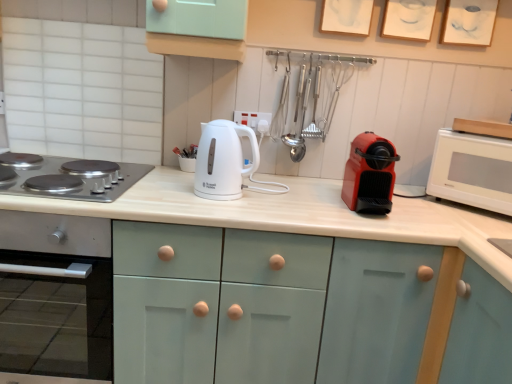
Measure the distance between point (220,158) and camera.

A distance of 4.13 feet exists between point (220,158) and camera.

Find the location of a particular element. The width and height of the screenshot is (512, 384). white glossy electric kettle at center, acting as the 1th kitchen appliance starting from the left is located at coordinates (223, 160).

What is the approximate width of white matte countertop at center?

4.68 feet.

What is the approximate width of red matte coffee machine at right, which is the 2th kitchen appliance from left to right?

11.69 inches.

In order to face white glossy microwave at right, should I rotate leftwards or rightwards?

To face it directly, rotate right by 28.794 degrees.

At what (x,y) coordinates should I click in order to perform the action: click on white glossy electric kettle at center, which appears as the 2th kitchen appliance when viewed from the right. Please return your answer as a coordinate pair (x, y). Looking at the image, I should click on (223, 160).

Between red matte coffee machine at right, the 1th kitchen appliance from the right, and white matte countertop at center, which one appears on the left side from the viewer's perspective?

Positioned to the left is white matte countertop at center.

Is red matte coffee machine at right, which is the 2th kitchen appliance from left to right, closer to the viewer compared to white matte countertop at center?

No.

Which object is thinner, red matte coffee machine at right, which is the 2th kitchen appliance from left to right, or white matte countertop at center?

Thinner between the two is red matte coffee machine at right, which is the 2th kitchen appliance from left to right.

From the image's perspective, is red matte coffee machine at right, which is the 2th kitchen appliance from left to right, on white matte countertop at center?

Yes, from the image's perspective, red matte coffee machine at right, which is the 2th kitchen appliance from left to right, is above white matte countertop at center.

Considering the relative positions of stainless steel gas stove at left and white matte countertop at center in the image provided, is stainless steel gas stove at left in front of white matte countertop at center?

No, it is behind white matte countertop at center.

I want to click on gas stove lying behind the white matte countertop at center, so click(83, 180).

Does stainless steel gas stove at left have a smaller size compared to white matte countertop at center?

Yes.

From the picture: From the image's perspective, which object appears higher, stainless steel gas stove at left or white matte countertop at center?

stainless steel gas stove at left is shown above in the image.

Is white matte countertop at center to the left of red matte coffee machine at right, which is the 2th kitchen appliance from left to right, from the viewer's perspective?

Correct, you'll find white matte countertop at center to the left of red matte coffee machine at right, which is the 2th kitchen appliance from left to right.

From the image's perspective, which object appears higher, white matte countertop at center or red matte coffee machine at right, the 1th kitchen appliance from the right?

From the image's view, red matte coffee machine at right, the 1th kitchen appliance from the right, is above.

Considering the relative sizes of white matte countertop at center and red matte coffee machine at right, the 1th kitchen appliance from the right, in the image provided, is white matte countertop at center thinner than red matte coffee machine at right, the 1th kitchen appliance from the right,?

No.

Is white matte countertop at center not inside red matte coffee machine at right, which is the 2th kitchen appliance from left to right?

Yes, white matte countertop at center is not within red matte coffee machine at right, which is the 2th kitchen appliance from left to right.

Consider the image. From the image's perspective, would you say white matte countertop at center is shown under white glossy electric kettle at center, which appears as the 2th kitchen appliance when viewed from the right?

Yes, from the image's perspective, white matte countertop at center is below white glossy electric kettle at center, which appears as the 2th kitchen appliance when viewed from the right.

In the scene shown: Which is closer to the camera, (x=135, y=191) or (x=196, y=175)?

Point (x=135, y=191) appears to be farther away from the viewer than point (x=196, y=175).

Which object is positioned more to the left, white matte countertop at center or white glossy electric kettle at center, acting as the 1th kitchen appliance starting from the left?

white glossy electric kettle at center, acting as the 1th kitchen appliance starting from the left, is more to the left.

Does white matte countertop at center have a larger size compared to white glossy electric kettle at center, acting as the 1th kitchen appliance starting from the left?

Yes.

Would you consider stainless steel gas stove at left to be distant from white glossy microwave at right?

Yes, stainless steel gas stove at left and white glossy microwave at right are located far from each other.

From a real-world perspective, is stainless steel gas stove at left physically located above or below white glossy microwave at right?

Clearly, from a real-world perspective, stainless steel gas stove at left is below white glossy microwave at right.

In the image, is stainless steel gas stove at left on the left side or the right side of white glossy microwave at right?

Based on their positions, stainless steel gas stove at left is located to the left of white glossy microwave at right.

From the image's perspective, is stainless steel gas stove at left below white glossy microwave at right?

No.

Consider the image. From a real-world perspective, is red matte coffee machine at right, the 1th kitchen appliance from the right, beneath stainless steel gas stove at left?

No.

At what (x,y) coordinates should I click in order to perform the action: click on gas stove on the left of red matte coffee machine at right, the 1th kitchen appliance from the right. Please return your answer as a coordinate pair (x, y). The image size is (512, 384). Looking at the image, I should click on (83, 180).

From the image's perspective, is red matte coffee machine at right, the 1th kitchen appliance from the right, above stainless steel gas stove at left?

No, from the image's perspective, red matte coffee machine at right, the 1th kitchen appliance from the right, is not over stainless steel gas stove at left.

Who is smaller, red matte coffee machine at right, which is the 2th kitchen appliance from left to right, or stainless steel gas stove at left?

Smaller between the two is red matte coffee machine at right, which is the 2th kitchen appliance from left to right.

From a real-world perspective, does red matte coffee machine at right, which is the 2th kitchen appliance from left to right, sit lower than white glossy electric kettle at center, acting as the 1th kitchen appliance starting from the left?

Yes, from a real-world perspective, red matte coffee machine at right, which is the 2th kitchen appliance from left to right, is beneath white glossy electric kettle at center, acting as the 1th kitchen appliance starting from the left.

Which is in front, red matte coffee machine at right, which is the 2th kitchen appliance from left to right, or white glossy electric kettle at center, acting as the 1th kitchen appliance starting from the left?

red matte coffee machine at right, which is the 2th kitchen appliance from left to right, is in front.

Is red matte coffee machine at right, which is the 2th kitchen appliance from left to right, next to white glossy electric kettle at center, acting as the 1th kitchen appliance starting from the left, and touching it?

No, red matte coffee machine at right, which is the 2th kitchen appliance from left to right, is not beside white glossy electric kettle at center, acting as the 1th kitchen appliance starting from the left.

Which is behind, point (397, 156) or point (231, 180)?

The point (397, 156) is farther.

From the image's perspective, which kitchen appliance is the 1st one above the white matte countertop at center? Please provide its 2D coordinates.

[(370, 174)]

Where is `gas stove that is on the left side of white matte countertop at center`? gas stove that is on the left side of white matte countertop at center is located at coordinates (83, 180).

Considering their positions, is white glossy electric kettle at center, which appears as the 2th kitchen appliance when viewed from the right, positioned closer to white matte countertop at center than red matte coffee machine at right, which is the 2th kitchen appliance from left to right?

red matte coffee machine at right, which is the 2th kitchen appliance from left to right.

Based on their spatial positions, is stainless steel gas stove at left or white glossy electric kettle at center, which appears as the 2th kitchen appliance when viewed from the right, further from white glossy microwave at right?

stainless steel gas stove at left.

Considering their positions, is white glossy electric kettle at center, which appears as the 2th kitchen appliance when viewed from the right, positioned further to stainless steel gas stove at left than red matte coffee machine at right, the 1th kitchen appliance from the right?

red matte coffee machine at right, the 1th kitchen appliance from the right, is positioned further to the anchor stainless steel gas stove at left.

In the scene shown: Considering their positions, is red matte coffee machine at right, the 1th kitchen appliance from the right, positioned further to stainless steel gas stove at left than white glossy microwave at right?

Based on the image, white glossy microwave at right appears to be further to stainless steel gas stove at left.

From the image, which object appears to be farther from stainless steel gas stove at left, white glossy electric kettle at center, which appears as the 2th kitchen appliance when viewed from the right, or white glossy microwave at right?

white glossy microwave at right is positioned further to the anchor stainless steel gas stove at left.

Looking at the image, which one is located closer to stainless steel gas stove at left, white matte countertop at center or white glossy electric kettle at center, which appears as the 2th kitchen appliance when viewed from the right?

white glossy electric kettle at center, which appears as the 2th kitchen appliance when viewed from the right.

Looking at the image, which one is located closer to stainless steel gas stove at left, white glossy microwave at right or white matte countertop at center?

Among the two, white matte countertop at center is located nearer to stainless steel gas stove at left.

Looking at the image, which one is located closer to white glossy electric kettle at center, acting as the 1th kitchen appliance starting from the left, white matte countertop at center or red matte coffee machine at right, which is the 2th kitchen appliance from left to right?

Among the two, white matte countertop at center is located nearer to white glossy electric kettle at center, acting as the 1th kitchen appliance starting from the left.

Where is `kitchen appliance between white matte countertop at center and white glossy electric kettle at center, acting as the 1th kitchen appliance starting from the left, from front to back`? The height and width of the screenshot is (384, 512). kitchen appliance between white matte countertop at center and white glossy electric kettle at center, acting as the 1th kitchen appliance starting from the left, from front to back is located at coordinates (370, 174).

Where is `gas stove between white matte countertop at center and white glossy electric kettle at center, which appears as the 2th kitchen appliance when viewed from the right, from front to back`? gas stove between white matte countertop at center and white glossy electric kettle at center, which appears as the 2th kitchen appliance when viewed from the right, from front to back is located at coordinates (83, 180).

The image size is (512, 384). I want to click on countertop between white glossy electric kettle at center, which appears as the 2th kitchen appliance when viewed from the right, and white glossy microwave at right, so click(296, 215).

You are a GUI agent. You are given a task and a screenshot of the screen. Output one action in this format:
    pyautogui.click(x=<x>, y=<y>)
    Task: Click on the kitchen appliance located between white matte countertop at center and white glossy microwave at right in the left-right direction
    
    Given the screenshot: What is the action you would take?
    pyautogui.click(x=370, y=174)